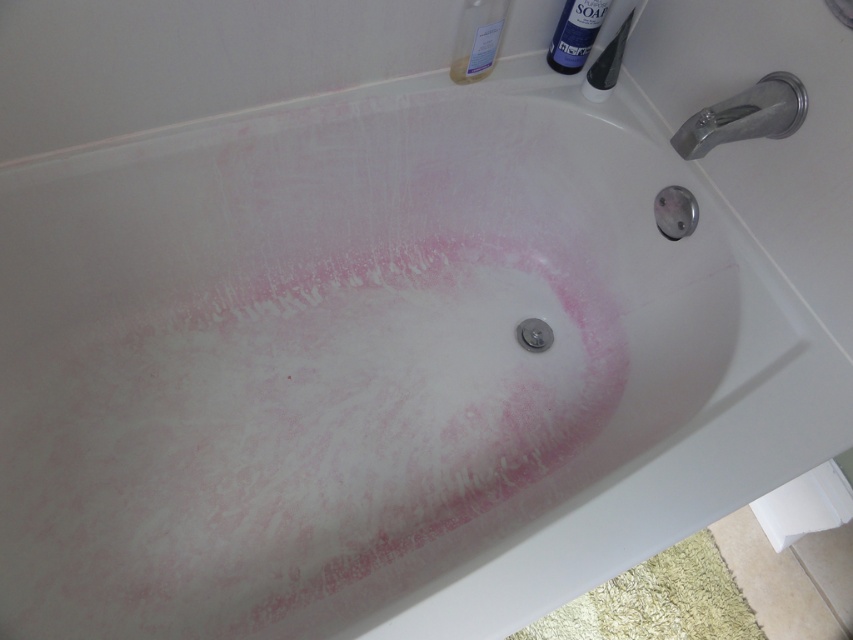
Question: From the image, what is the correct spatial relationship of satin nickel faucet at upper right in relation to clear plastic bottle at upper center?

Choices:
 (A) above
 (B) below

Answer: (B)

Question: In this image, where is satin nickel faucet at upper right located relative to blue plastic soap dispenser at upper right?

Choices:
 (A) above
 (B) below

Answer: (B)

Question: Is satin nickel faucet at upper right smaller than blue plastic soap dispenser at upper right?

Choices:
 (A) yes
 (B) no

Answer: (B)

Question: Which of the following is the farthest from the observer?

Choices:
 (A) clear plastic bottle at upper center
 (B) blue plastic soap dispenser at upper right

Answer: (B)

Question: Which object is closer to the camera taking this photo?

Choices:
 (A) satin nickel faucet at upper right
 (B) clear plastic bottle at upper center
 (C) blue plastic soap dispenser at upper right

Answer: (A)

Question: Which object is farther from the camera taking this photo?

Choices:
 (A) satin nickel faucet at upper right
 (B) clear plastic bottle at upper center

Answer: (B)